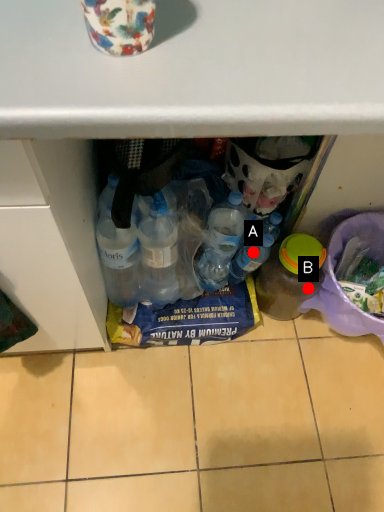
Question: Two points are circled on the image, labeled by A and B beside each circle. Which point is closer to the camera?

Choices:
 (A) A is closer
 (B) B is closer

Answer: (A)